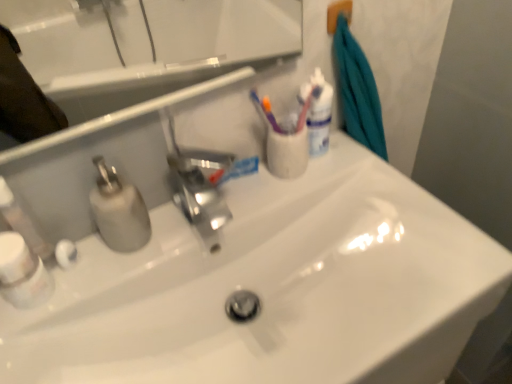
Question: Considering the relative sizes of white plastic bottle at lower left, the 1th mouthwash when ordered from front to back, and white glossy toothpaste at center in the image provided, is white plastic bottle at lower left, the 1th mouthwash when ordered from front to back, bigger than white glossy toothpaste at center?

Choices:
 (A) yes
 (B) no

Answer: (A)

Question: Does white plastic bottle at lower left, arranged as the first mouthwash when ordered from the bottom, have a lesser height compared to white glossy toothpaste at center?

Choices:
 (A) yes
 (B) no

Answer: (B)

Question: Could you tell me if white plastic bottle at lower left, the first mouthwash in the left-to-right sequence, is facing white glossy toothpaste at center?

Choices:
 (A) yes
 (B) no

Answer: (B)

Question: Does white plastic bottle at lower left, the second mouthwash positioned from the right, have a greater height compared to white glossy toothpaste at center?

Choices:
 (A) no
 (B) yes

Answer: (B)

Question: From a real-world perspective, is white plastic bottle at lower left, the first mouthwash in the left-to-right sequence, physically below white glossy toothpaste at center?

Choices:
 (A) no
 (B) yes

Answer: (A)

Question: Is white plastic bottle at lower left, the first mouthwash in the left-to-right sequence, wider than white glossy toothpaste at center?

Choices:
 (A) yes
 (B) no

Answer: (A)

Question: Is white glossy sink at center thinner than white plastic soap dispenser at left?

Choices:
 (A) yes
 (B) no

Answer: (B)

Question: Could you tell me if white glossy sink at center is facing white plastic soap dispenser at left?

Choices:
 (A) yes
 (B) no

Answer: (B)

Question: Is white plastic soap dispenser at left located within white glossy sink at center?

Choices:
 (A) no
 (B) yes

Answer: (A)

Question: Does white glossy sink at center come behind white plastic soap dispenser at left?

Choices:
 (A) yes
 (B) no

Answer: (B)

Question: Is white glossy sink at center outside white plastic soap dispenser at left?

Choices:
 (A) yes
 (B) no

Answer: (A)

Question: Can you confirm if white glossy sink at center is shorter than white plastic soap dispenser at left?

Choices:
 (A) no
 (B) yes

Answer: (B)

Question: Can you confirm if white plastic soap dispenser at left is thinner than white glossy sink at center?

Choices:
 (A) no
 (B) yes

Answer: (B)